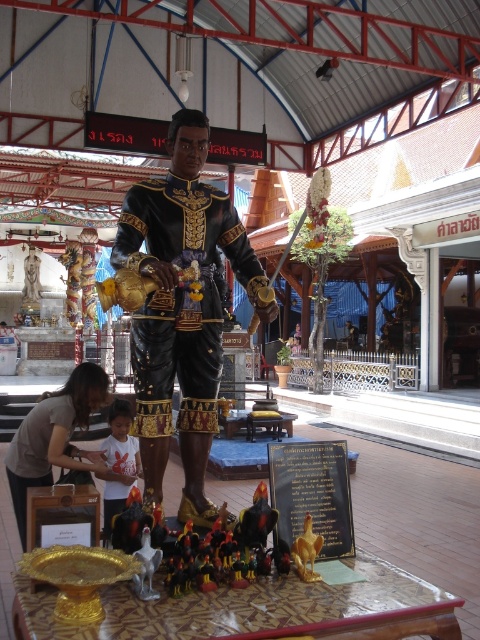
Question: Is brown fabric shirt at lower left to the left of white cotton shirt at center from the viewer's perspective?

Choices:
 (A) no
 (B) yes

Answer: (B)

Question: Is black glossy statue at center to the left of gold polished table at center from the viewer's perspective?

Choices:
 (A) yes
 (B) no

Answer: (A)

Question: Which object is closer to the camera taking this photo?

Choices:
 (A) brown fabric shirt at lower left
 (B) gold polished table at center
 (C) gold metallic toy at center

Answer: (B)

Question: Which object appears farthest from the camera in this image?

Choices:
 (A) white cotton shirt at center
 (B) gold metallic toy at center

Answer: (A)

Question: Is brown fabric shirt at lower left thinner than white cotton shirt at center?

Choices:
 (A) yes
 (B) no

Answer: (B)

Question: Which of the following is the farthest from the observer?

Choices:
 (A) (184, 186)
 (B) (81, 371)
 (C) (312, 538)
 (D) (235, 608)

Answer: (B)